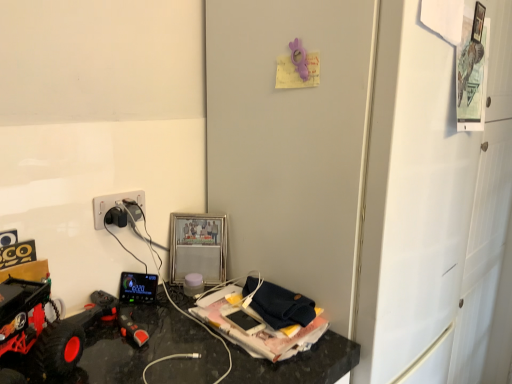
Question: From a real-world perspective, is rubberized black remote control at lower left, which ranks as the 1th toy in bottom-to-top order, positioned under white matte door at center-right based on gravity?

Choices:
 (A) yes
 (B) no

Answer: (A)

Question: Is rubberized black remote control at lower left, the 3th toy viewed from the right, bigger than white matte door at center-right?

Choices:
 (A) no
 (B) yes

Answer: (A)

Question: Is rubberized black remote control at lower left, which ranks as the 1th toy in bottom-to-top order, behind white matte door at center-right?

Choices:
 (A) yes
 (B) no

Answer: (A)

Question: Is rubberized black remote control at lower left, the 3th toy viewed from the right, wider than white matte door at center-right?

Choices:
 (A) yes
 (B) no

Answer: (B)

Question: From the image's perspective, is rubberized black remote control at lower left, the first toy positioned from the front, beneath white matte door at center-right?

Choices:
 (A) yes
 (B) no

Answer: (A)

Question: Could you tell me if rubberized black remote control at lower left, the first toy positioned from the front, is turned towards white matte door at center-right?

Choices:
 (A) yes
 (B) no

Answer: (B)

Question: Is purple rubber duck at upper center, acting as the first toy starting from the top, not close to matte white cup at center, acting as the 2th toy starting from the top?

Choices:
 (A) yes
 (B) no

Answer: (B)

Question: Considering the relative sizes of purple rubber duck at upper center, which appears as the 3th toy when ordered from the bottom, and matte white cup at center, acting as the 2th toy starting from the top, in the image provided, is purple rubber duck at upper center, which appears as the 3th toy when ordered from the bottom, bigger than matte white cup at center, acting as the 2th toy starting from the top,?

Choices:
 (A) no
 (B) yes

Answer: (A)

Question: Is purple rubber duck at upper center, which appears as the 3th toy when ordered from the bottom, positioned beyond the bounds of matte white cup at center, the second toy viewed from the left?

Choices:
 (A) no
 (B) yes

Answer: (B)

Question: Is purple rubber duck at upper center, the 1th toy from the right, thinner than matte white cup at center, placed as the second toy when sorted from bottom to top?

Choices:
 (A) yes
 (B) no

Answer: (A)

Question: Does purple rubber duck at upper center, which appears as the 3th toy when ordered from the bottom, appear on the left side of matte white cup at center, positioned as the 1th toy in back-to-front order?

Choices:
 (A) no
 (B) yes

Answer: (A)

Question: Is purple rubber duck at upper center, the 1th toy from the right, next to matte white cup at center, which is counted as the second toy, starting from the right, and touching it?

Choices:
 (A) no
 (B) yes

Answer: (A)

Question: Is rubberized black toy car at lower left thinner than matte white cup at center, which is the third toy from front to back?

Choices:
 (A) no
 (B) yes

Answer: (A)